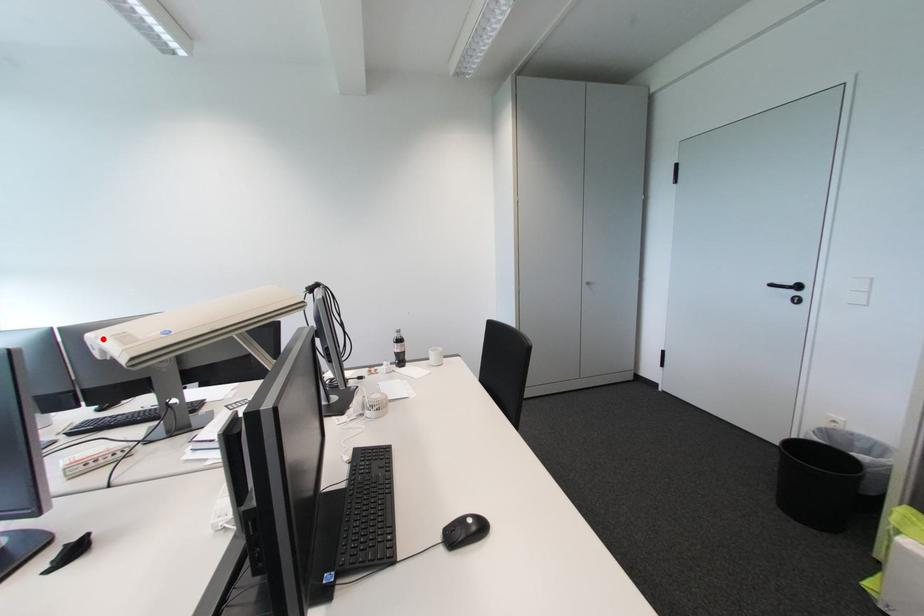
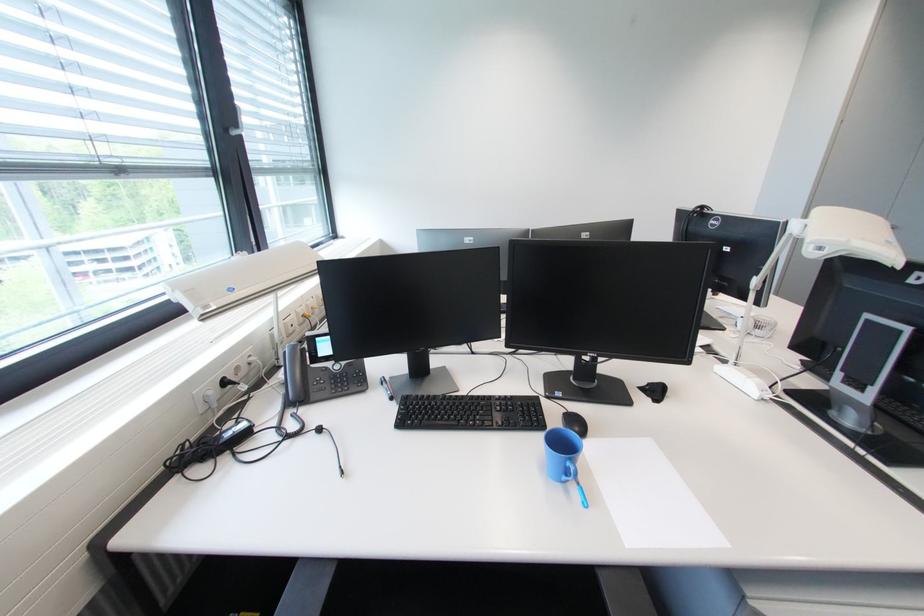
Find the pixel in the second image that matches the highlighted location in the first image.

(856, 243)